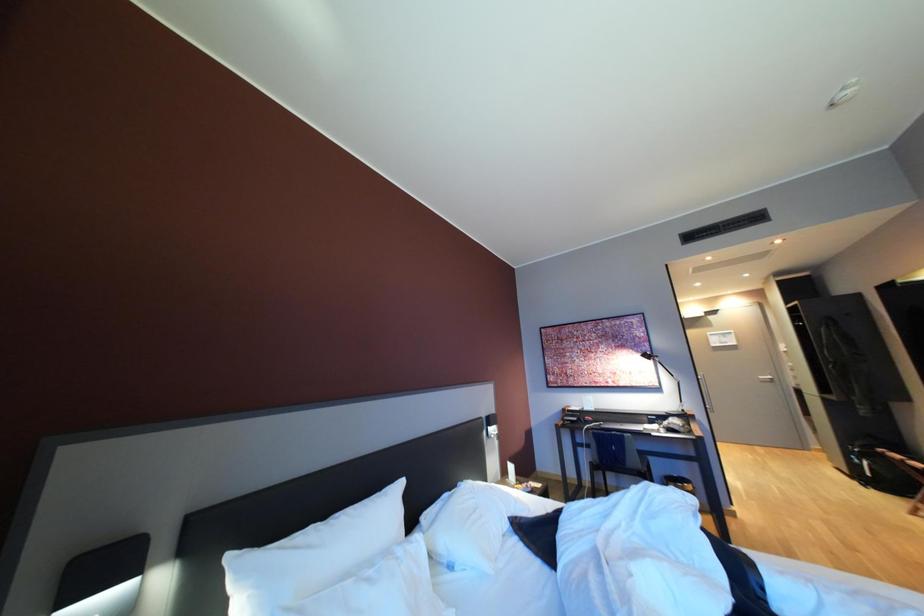
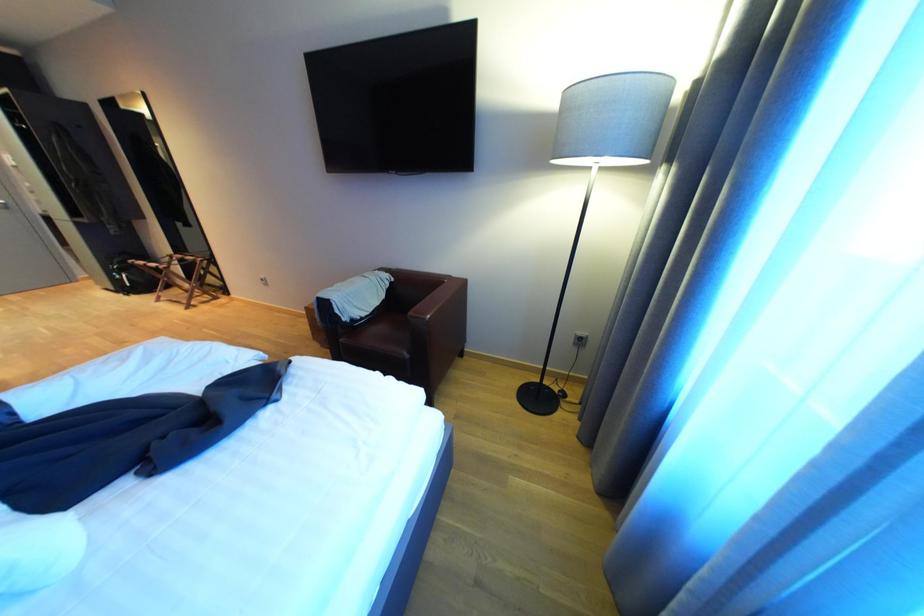
Looking at this image, based on the continuous images, in which direction is the camera rotating?

The camera rotated toward right-down.